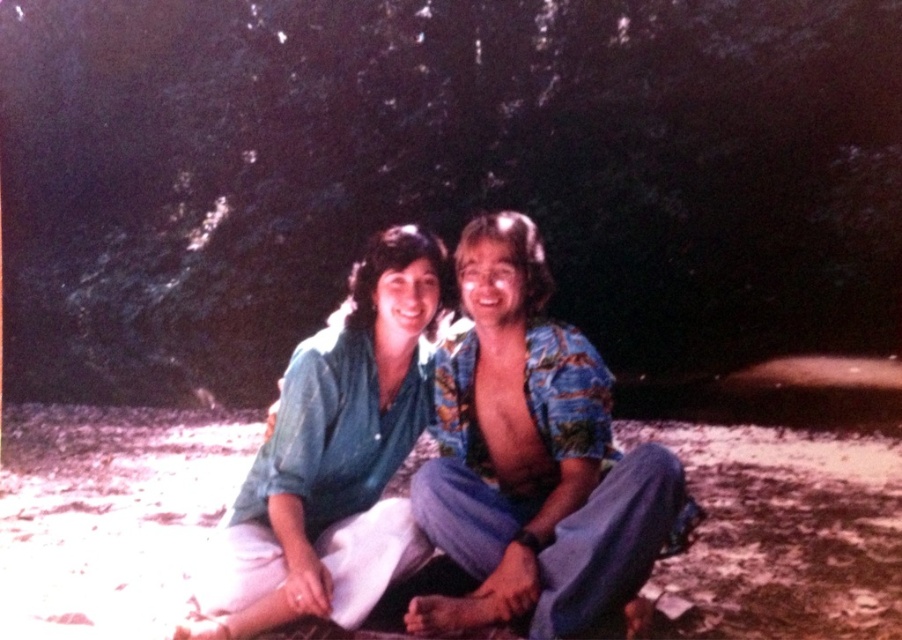
You are a photographer trying to capture a closeup of the matte blue shirt at center without including the white sandy ground at center in the frame. Given their sizes, is this possible?

The white sandy ground at center is bigger than the matte blue shirt at center, so it is possible to focus on the matte blue shirt at center without including the white sandy ground at center by adjusting the camera angle to exclude the larger ground area.